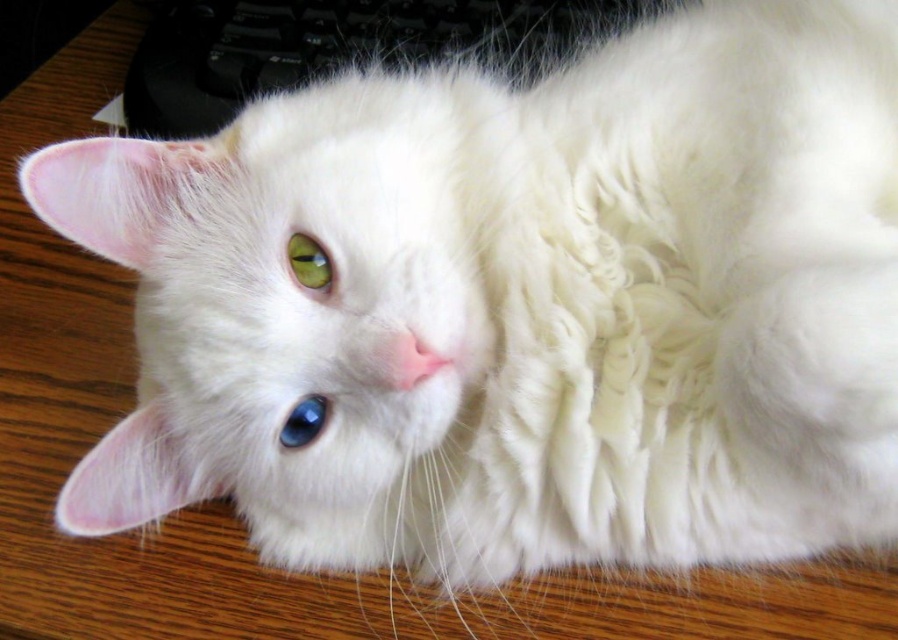
Question: Is black plastic keyboard at upper center closer to the viewer compared to green glossy eye at center?

Choices:
 (A) no
 (B) yes

Answer: (A)

Question: Which point is farther to the camera?

Choices:
 (A) (582, 35)
 (B) (293, 422)
 (C) (321, 280)

Answer: (A)

Question: Which of the following is the farthest from the observer?

Choices:
 (A) (330, 273)
 (B) (480, 32)
 (C) (322, 426)

Answer: (B)

Question: Which of the following is the closest to the observer?

Choices:
 (A) (287, 252)
 (B) (192, 77)

Answer: (A)

Question: Is black plastic keyboard at upper center to the left of green glossy eye at center from the viewer's perspective?

Choices:
 (A) yes
 (B) no

Answer: (B)

Question: Is black plastic keyboard at upper center smaller than blue glossy eye at center?

Choices:
 (A) no
 (B) yes

Answer: (A)